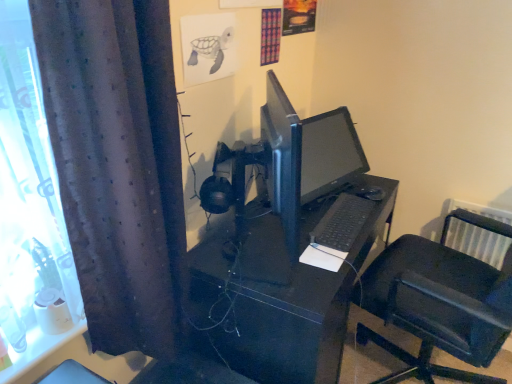
Image resolution: width=512 pixels, height=384 pixels. I want to click on blank space situated above black matte keyboard at center (from a real-world perspective), so click(347, 205).